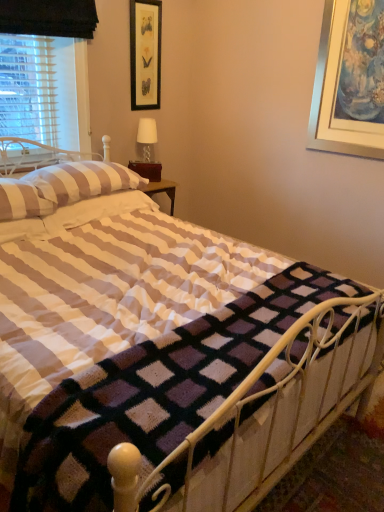
Question: From a real-world perspective, relative to white striped pillow at upper left, positioned as the 1th pillow in front-to-back order, is white fabric lampshade at upper center vertically above or below?

Choices:
 (A) above
 (B) below

Answer: (A)

Question: Does point (140, 122) appear closer or farther from the camera than point (6, 204)?

Choices:
 (A) closer
 (B) farther

Answer: (B)

Question: Which of these objects is positioned closest to the white striped pillow at upper left, which is counted as the second pillow, starting from the back?

Choices:
 (A) white striped fabric at left
 (B) black framed picture at upper center
 (C) white fabric lampshade at upper center
 (D) white striped pillow at upper left, the 2th pillow positioned from the front

Answer: (D)

Question: Which object is the closest to the white striped pillow at upper left, the first pillow viewed from the back?

Choices:
 (A) black framed picture at upper center
 (B) white striped pillow at upper left, which is counted as the second pillow, starting from the back
 (C) white fabric lampshade at upper center
 (D) white striped fabric at left

Answer: (B)